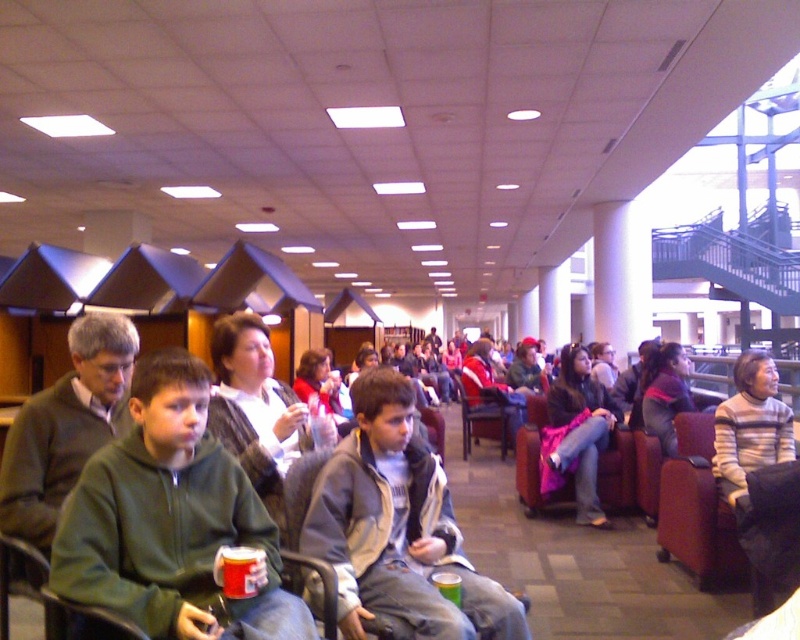
Question: Which object is the farthest from the green fleece jacket at center?

Choices:
 (A) striped sweater at right
 (B) gray fleece jacket at center
 (C) matte pink jacket at center
 (D) brown fabric chair at center

Answer: (D)

Question: Is matte pink jacket at center positioned behind brown fabric chair at center?

Choices:
 (A) yes
 (B) no

Answer: (B)

Question: Which of the following is the farthest from the observer?

Choices:
 (A) (466, 593)
 (B) (509, 440)

Answer: (B)

Question: Does gray fleece jacket at center appear on the left side of matte pink jacket at center?

Choices:
 (A) yes
 (B) no

Answer: (A)

Question: Which point appears farthest from the camera in this image?

Choices:
 (A) (772, 433)
 (B) (24, 536)
 (C) (182, 417)
 (D) (592, 397)

Answer: (D)

Question: Is green matte jacket at center wider than striped sweater at right?

Choices:
 (A) no
 (B) yes

Answer: (A)